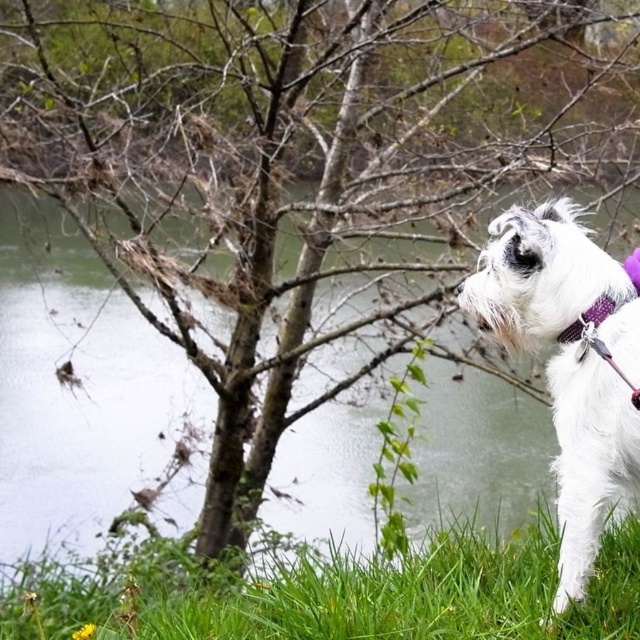
Is point (602, 634) farther from viewer compared to point (600, 300)?

Yes, point (602, 634) is farther from viewer.

Can you confirm if green grass at lower right is wider than purple fabric collar at right?

Yes.

Is point (332, 634) positioned in front of point (564, 339)?

No.

This screenshot has width=640, height=640. Find the location of `green grass at lower right`. green grass at lower right is located at coordinates point(340,595).

Locate an element on the screen. This screenshot has height=640, width=640. white fur dog at right is located at coordinates (566, 364).

Does white fur dog at right have a greater height compared to purple fabric collar at right?

Indeed, white fur dog at right has a greater height compared to purple fabric collar at right.

Is point (561, 353) less distant than point (566, 330)?

No, (561, 353) is behind (566, 330).

At what (x,y) coordinates should I click in order to perform the action: click on white fur dog at right. Please return your answer as a coordinate pair (x, y). This screenshot has height=640, width=640. Looking at the image, I should click on (566, 364).

The width and height of the screenshot is (640, 640). What do you see at coordinates (340, 595) in the screenshot?
I see `green grass at lower right` at bounding box center [340, 595].

Which of these two, green grass at lower right or white fur dog at right, stands taller?

With more height is white fur dog at right.

Find the location of `green grass at lower right`. green grass at lower right is located at coordinates (340, 595).

Identify the location of green grass at lower right. The image size is (640, 640). (340, 595).